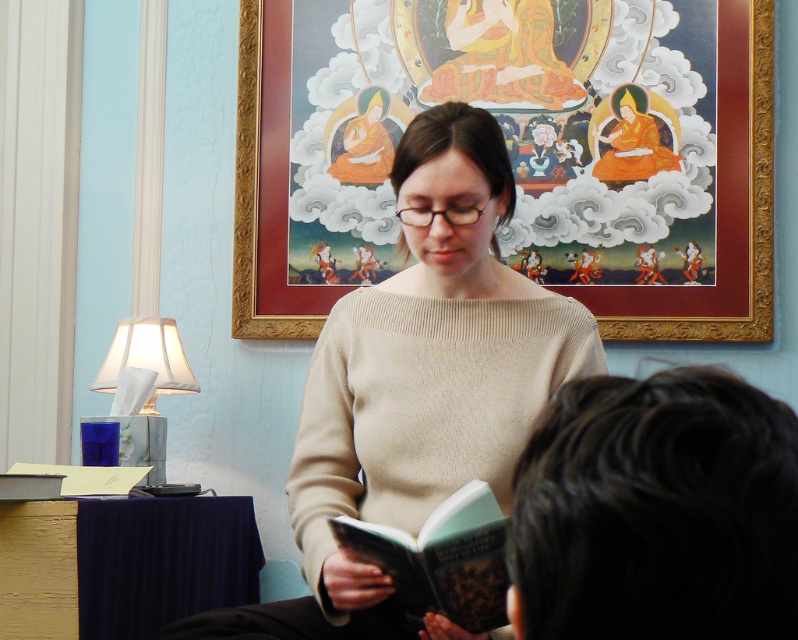
Question: Which point is closer to the camera?

Choices:
 (A) (176, 339)
 (B) (723, 138)
 (C) (796, 611)

Answer: (C)

Question: Which point is farther to the camera?

Choices:
 (A) (510, 525)
 (B) (610, 172)
 (C) (463, 516)
 (D) (311, 451)

Answer: (B)

Question: Considering the relative positions of hardcover book at center and white fabric lampshade at left in the image provided, where is hardcover book at center located with respect to white fabric lampshade at left?

Choices:
 (A) left
 (B) right

Answer: (B)

Question: Is gold-framed picture at upper center wider than beige knitted sweater at center?

Choices:
 (A) yes
 (B) no

Answer: (A)

Question: Which object is closer to the camera taking this photo?

Choices:
 (A) dark brown hair at center
 (B) hardcover book at center

Answer: (A)

Question: Does hardcover book at center appear on the right side of white fabric lampshade at left?

Choices:
 (A) no
 (B) yes

Answer: (B)